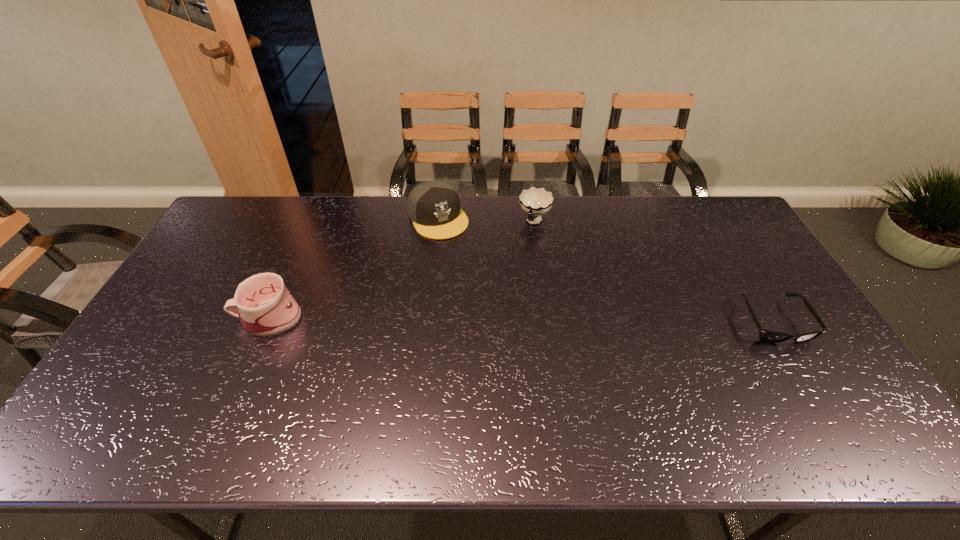
Identify the location of mug. tap(266, 308).

At what (x,y) coordinates should I click in order to perform the action: click on the rightmost object. Please return your answer as a coordinate pair (x, y). The height and width of the screenshot is (540, 960). Looking at the image, I should click on (769, 336).

Find the location of a particular element. The image size is (960, 540). the shortest object is located at coordinates (769, 336).

Where is `cup`? Image resolution: width=960 pixels, height=540 pixels. cup is located at coordinates (535, 202).

Where is `the third object from right to left`? The width and height of the screenshot is (960, 540). the third object from right to left is located at coordinates (434, 207).

The height and width of the screenshot is (540, 960). I want to click on blank space located on the side with the handle of the leftmost object, so click(x=200, y=318).

Identify the location of vacant space located on the side with the handle of the leftmost object. (186, 318).

Find the location of a particular element. This screenshot has width=960, height=540. vacant area situated on the side with the handle of the leftmost object is located at coordinates (189, 318).

Locate an element on the screen. Image resolution: width=960 pixels, height=540 pixels. vacant area situated on the front-facing side of the shortest object is located at coordinates 818,397.

I want to click on free location located on the side of the second object from right to left with the handle, so click(x=526, y=245).